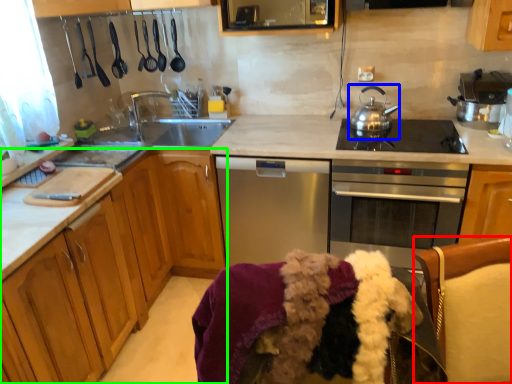
Question: Which is farther away from swivel chair (highlighted by a red box)? tea pot (highlighted by a blue box) or cabinetry (highlighted by a green box)?

Choices:
 (A) tea pot
 (B) cabinetry

Answer: (B)